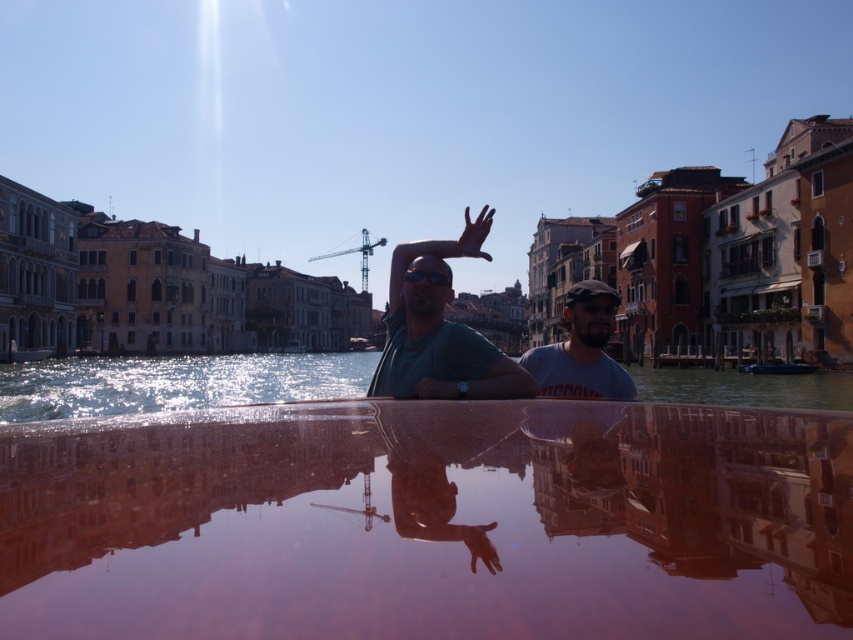
Question: Which object is positioned closest to the shiny reflective water at center?

Choices:
 (A) black plastic goggles at center
 (B) matte green shirt at center
 (C) gray cotton t-shirt at center

Answer: (B)

Question: Which point appears closest to the camera in this image?

Choices:
 (A) (498, 364)
 (B) (224, 365)

Answer: (A)

Question: Does clear glass water at center lie in front of matte green shirt at center?

Choices:
 (A) yes
 (B) no

Answer: (B)

Question: Is shiny reflective water at center smaller than gray cotton t-shirt at center?

Choices:
 (A) no
 (B) yes

Answer: (B)

Question: Is matte green shirt at center wider than black plastic goggles at center?

Choices:
 (A) yes
 (B) no

Answer: (A)

Question: Estimate the real-world distances between objects in this image. Which object is farther from the shiny reflective water at center?

Choices:
 (A) matte green shirt at center
 (B) clear glass water at center
 (C) black plastic goggles at center
 (D) gray cotton t-shirt at center

Answer: (B)